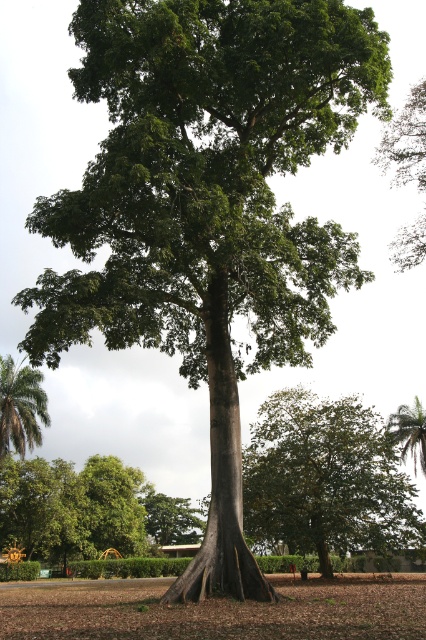
Question: Which is nearer to the green leafy palm tree at lower left?

Choices:
 (A) green leafy palm tree at upper right
 (B) green leafy tree at upper right
 (C) brown dry soil at center

Answer: (C)

Question: Is brown dry soil at center below green leafy tree at upper right?

Choices:
 (A) no
 (B) yes

Answer: (B)

Question: Is the position of brown dry soil at center more distant than that of green leafy palm tree at upper right?

Choices:
 (A) yes
 (B) no

Answer: (B)

Question: Which point is closer to the camera?

Choices:
 (A) (8, 449)
 (B) (371, 616)
 (C) (412, 449)

Answer: (B)

Question: Can you confirm if green leafy palm tree at lower left is positioned to the right of green leafy palm tree at upper right?

Choices:
 (A) no
 (B) yes

Answer: (A)

Question: Based on their relative distances, which object is nearer to the brown dry soil at center?

Choices:
 (A) green leafy palm tree at upper right
 (B) green leafy tree at upper right

Answer: (B)